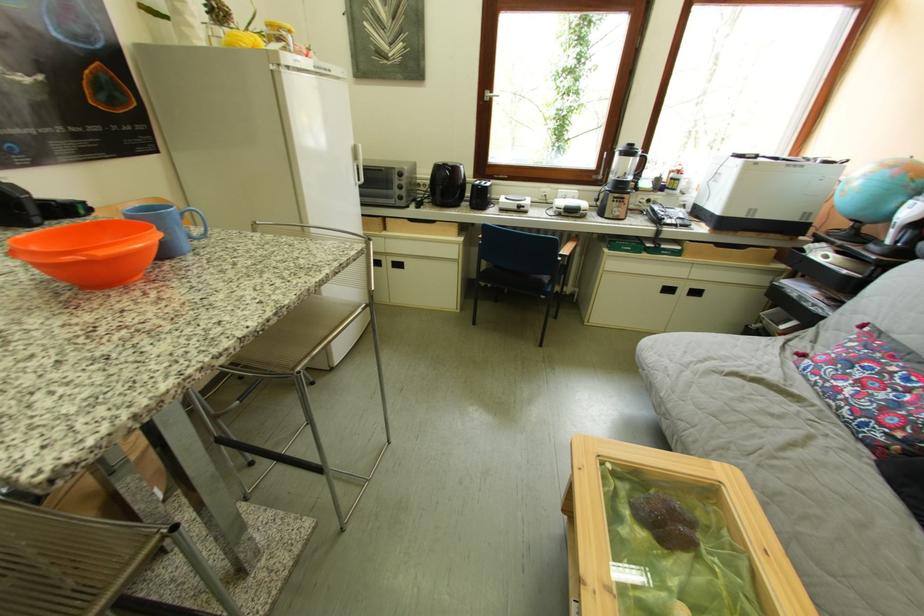
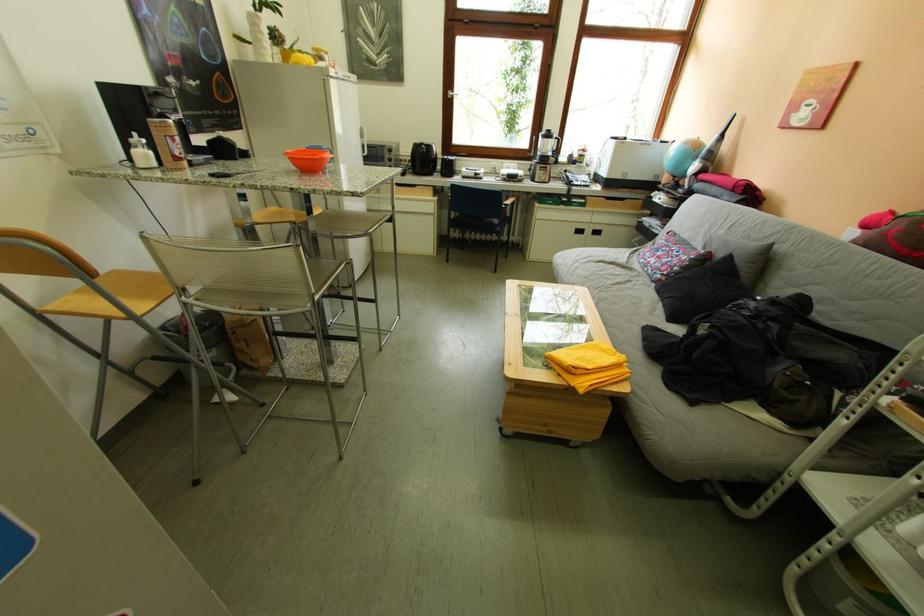
Where in the second image is the point corresponding to (x=606, y=180) from the first image?

(541, 156)